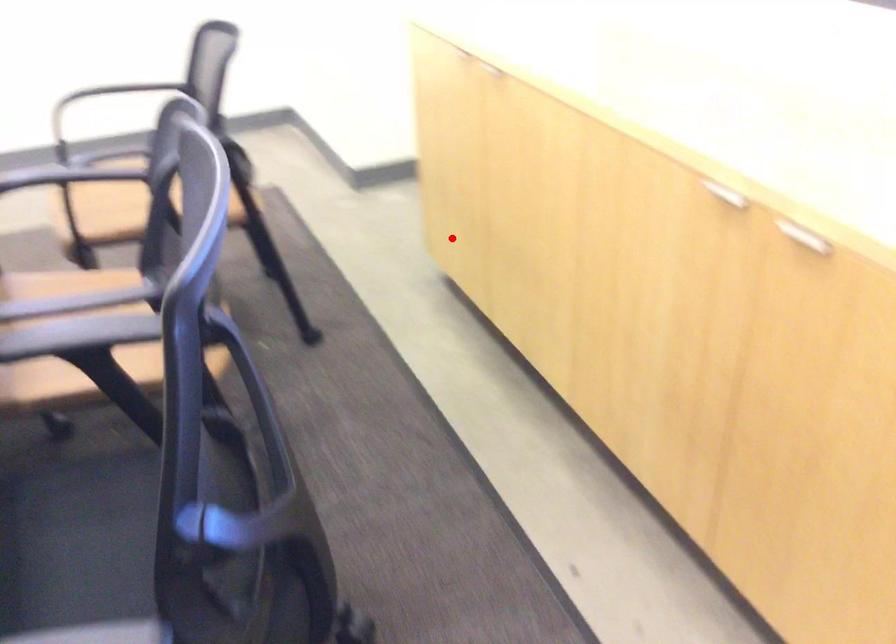
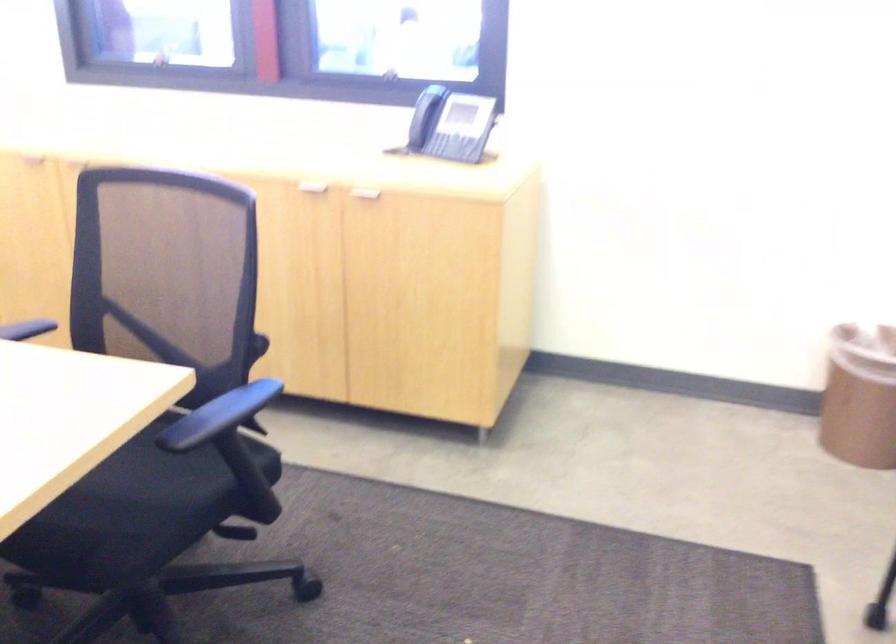
The point at the highlighted location is marked in the first image. Where is the corresponding point in the second image?

(38, 308)